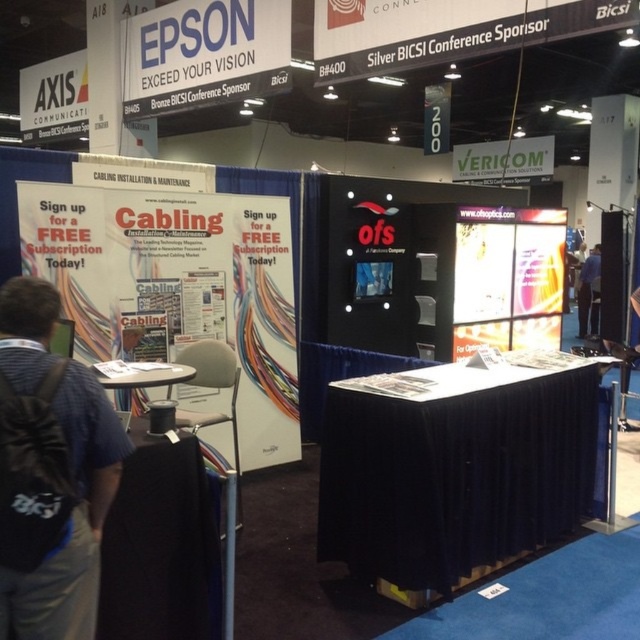
Question: Among these points, which one is nearest to the camera?

Choices:
 (A) (16, 557)
 (B) (586, 301)

Answer: (A)

Question: Among these objects, which one is farthest from the camera?

Choices:
 (A) white paperboard at upper left
 (B) black backpack at lower left
 (C) blue fabric at right

Answer: (C)

Question: Does black fabric table at center appear on the left side of green matte sign at upper center?

Choices:
 (A) yes
 (B) no

Answer: (A)

Question: Can you confirm if white paperboard at upper left is positioned above blue fabric at right?

Choices:
 (A) no
 (B) yes

Answer: (B)

Question: Among these points, which one is nearest to the camera?

Choices:
 (A) (577, 296)
 (B) (552, 500)
 (C) (497, 141)

Answer: (B)

Question: Does white paperboard at upper left have a lesser width compared to green matte sign at upper center?

Choices:
 (A) yes
 (B) no

Answer: (B)